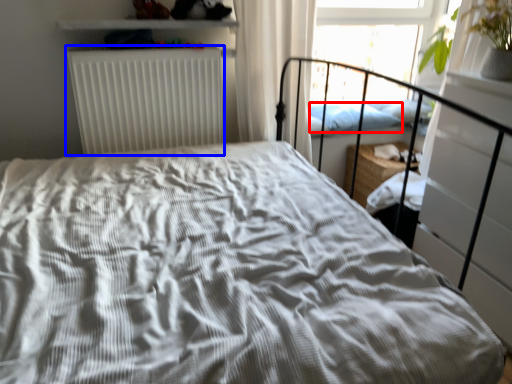
Question: Which point is closer to the camera, pillow (highlighted by a red box) or radiator (highlighted by a blue box)?

Choices:
 (A) pillow
 (B) radiator

Answer: (B)